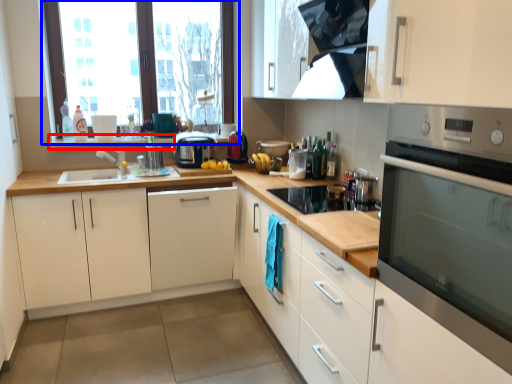
Question: Among these objects, which one is nearest to the camera, window sill (highlighted by a red box) or window (highlighted by a blue box)?

Choices:
 (A) window sill
 (B) window

Answer: (B)